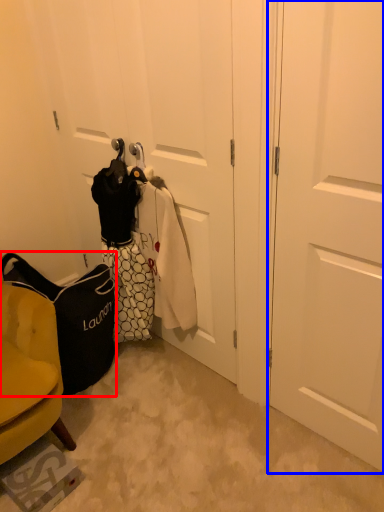
Question: Which object is closer to the camera taking this photo, handbag (highlighted by a red box) or door (highlighted by a blue box)?

Choices:
 (A) handbag
 (B) door

Answer: (B)